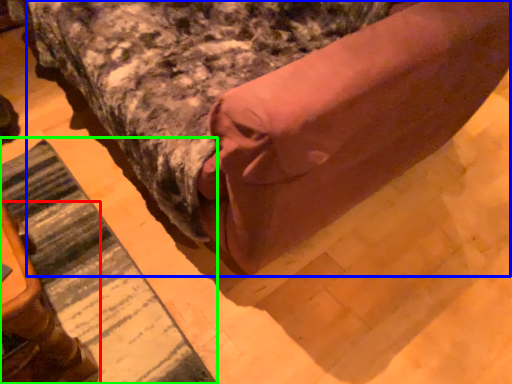
Question: Considering the real-world distances, which object is closest to furniture (highlighted by a red box)? bed (highlighted by a blue box) or mat (highlighted by a green box).

Choices:
 (A) bed
 (B) mat

Answer: (B)